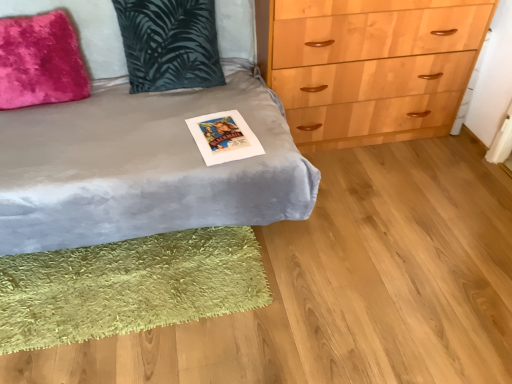
Question: Looking at the image, does matte paper postcard at center seem bigger or smaller compared to velvet gray bed at center?

Choices:
 (A) big
 (B) small

Answer: (B)

Question: Which is correct: matte paper postcard at center is inside velvet gray bed at center, or outside of it?

Choices:
 (A) outside
 (B) inside

Answer: (B)

Question: Which of these objects is positioned farthest from the fuzzy pink pillow at upper left, the 1th pillow positioned from the left?

Choices:
 (A) velvet gray bed at center
 (B) matte paper postcard at center
 (C) green shaggy rug at lower left
 (D) velvety dark green pillow at upper left, the first pillow when ordered from right to left

Answer: (C)

Question: Which object is the closest to the green shaggy rug at lower left?

Choices:
 (A) velvety dark green pillow at upper left, the second pillow in the left-to-right sequence
 (B) fuzzy pink pillow at upper left, the 1th pillow positioned from the left
 (C) matte paper postcard at center
 (D) velvet gray bed at center

Answer: (D)